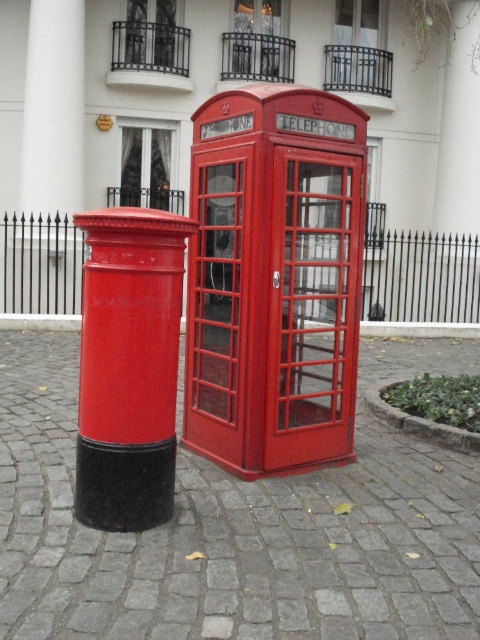
Is matte red telephone box at center positioned in front of white glossy pillar at upper left?

Yes, it is in front of white glossy pillar at upper left.

In the scene shown: Is matte red telephone box at center positioned at the back of white glossy pillar at upper left?

That is False.

Locate an element on the screen. The height and width of the screenshot is (640, 480). matte red telephone box at center is located at coordinates (274, 278).

Which is behind, point (274, 168) or point (121, 506)?

The point (274, 168) is more distant.

Does point (260, 182) come closer to viewer compared to point (98, 330)?

No, (260, 182) is behind (98, 330).

Where is `matte red telephone box at center`? The height and width of the screenshot is (640, 480). matte red telephone box at center is located at coordinates (274, 278).

From the picture: Can you confirm if matte red postbox at center is positioned above white glossy pillar at upper left?

Actually, matte red postbox at center is below white glossy pillar at upper left.

Is point (136, 452) farther from camera compared to point (56, 205)?

No, it is in front of (56, 205).

Is point (166, 500) positioned before point (83, 45)?

Yes, point (166, 500) is in front of point (83, 45).

Find the location of a particular element. matte red postbox at center is located at coordinates (129, 365).